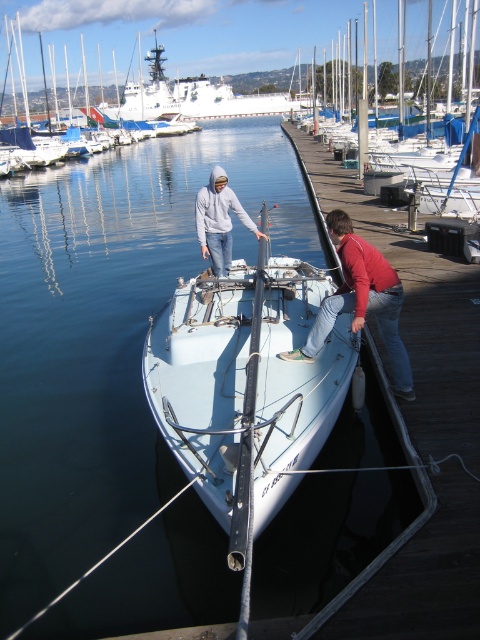
Does red cotton shirt at center have a greater width compared to light gray hoodie at center?

Incorrect, red cotton shirt at center's width does not surpass light gray hoodie at center's.

Can you confirm if red cotton shirt at center is positioned to the right of light gray hoodie at center?

Yes, red cotton shirt at center is to the right of light gray hoodie at center.

Image resolution: width=480 pixels, height=640 pixels. I want to click on red cotton shirt at center, so click(x=360, y=301).

Who is shorter, red cotton shirt at center or white glossy sailboat at upper center?

red cotton shirt at center is shorter.

Where is `red cotton shirt at center`? The height and width of the screenshot is (640, 480). red cotton shirt at center is located at coordinates (360, 301).

Does white matte sailboat at center appear on the left side of red cotton shirt at center?

Indeed, white matte sailboat at center is positioned on the left side of red cotton shirt at center.

The width and height of the screenshot is (480, 640). What do you see at coordinates (243, 387) in the screenshot?
I see `white matte sailboat at center` at bounding box center [243, 387].

In order to click on white matte sailboat at center in this screenshot , I will do `click(243, 387)`.